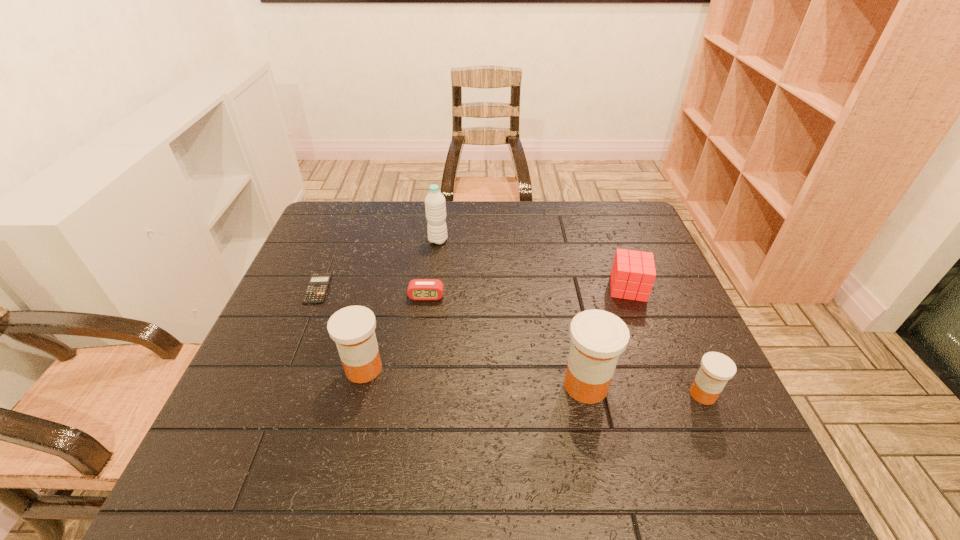
I want to click on vacant point located on the label of the third object from right to left, so click(402, 385).

Where is `free location located 0.240m on the label of the third object from right to left`? This screenshot has width=960, height=540. free location located 0.240m on the label of the third object from right to left is located at coordinates (449, 385).

The width and height of the screenshot is (960, 540). In order to click on free space located on the label of the third object from right to left in this screenshot , I will do `click(430, 385)`.

Find the location of a particular element. vacant space positioned on the label of the shortest medicine is located at coordinates (719, 429).

Find the location of a particular element. This screenshot has height=540, width=960. free point located on the front of the water bottle is located at coordinates (434, 277).

At what (x,y) coordinates should I click in order to perform the action: click on vacant area located on the front of the cube. Please return your answer as a coordinate pair (x, y). The height and width of the screenshot is (540, 960). Looking at the image, I should click on coord(680,425).

This screenshot has height=540, width=960. I want to click on vacant region located 0.200m on the right of the shortest object, so click(x=403, y=288).

What are the coordinates of `vacant position located on the front-facing side of the alarm clock` in the screenshot? It's located at (417, 366).

Find the location of a particular element. The width and height of the screenshot is (960, 540). object situated at the far edge is located at coordinates (435, 206).

Where is `object that is at the left edge`? This screenshot has height=540, width=960. object that is at the left edge is located at coordinates (316, 289).